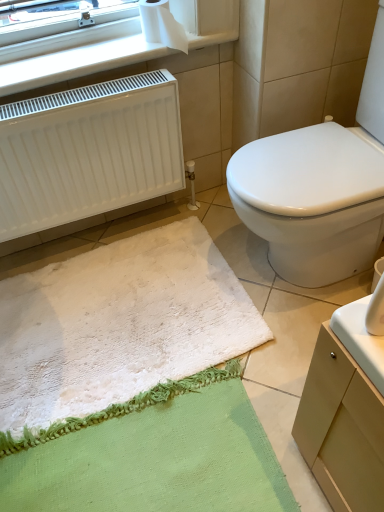
Question: Is white paper at upper left looking in the opposite direction of white glossy toilet at center?

Choices:
 (A) yes
 (B) no

Answer: (B)

Question: Does white paper at upper left have a lesser width compared to white glossy toilet at center?

Choices:
 (A) yes
 (B) no

Answer: (A)

Question: Does white paper at upper left have a lesser height compared to white glossy toilet at center?

Choices:
 (A) no
 (B) yes

Answer: (B)

Question: Can you confirm if white paper at upper left is wider than white glossy toilet at center?

Choices:
 (A) yes
 (B) no

Answer: (B)

Question: From the image's perspective, is white paper at upper left under white glossy toilet at center?

Choices:
 (A) yes
 (B) no

Answer: (B)

Question: From the image's perspective, is white plastic radiator at upper left above or below white paper at upper left?

Choices:
 (A) below
 (B) above

Answer: (A)

Question: Does point (155, 52) appear closer or farther from the camera than point (187, 52)?

Choices:
 (A) farther
 (B) closer

Answer: (B)

Question: Visually, is white plastic radiator at upper left positioned to the left or to the right of white paper at upper left?

Choices:
 (A) left
 (B) right

Answer: (A)

Question: In terms of size, does white plastic radiator at upper left appear bigger or smaller than white paper at upper left?

Choices:
 (A) big
 (B) small

Answer: (A)

Question: From the image's perspective, relative to white plastic radiator at upper left, is white glossy toilet at center above or below?

Choices:
 (A) above
 (B) below

Answer: (B)

Question: Relative to white plastic radiator at upper left, is white glossy toilet at center in front or behind?

Choices:
 (A) front
 (B) behind

Answer: (A)

Question: Is white glossy toilet at center bigger or smaller than white plastic radiator at upper left?

Choices:
 (A) small
 (B) big

Answer: (B)

Question: Is point (271, 143) closer or farther from the camera than point (135, 31)?

Choices:
 (A) farther
 (B) closer

Answer: (B)

Question: Is white fluffy bath mat at lower left bigger or smaller than white matte radiator at left?

Choices:
 (A) big
 (B) small

Answer: (B)

Question: From the image's perspective, is white fluffy bath mat at lower left located above or below white matte radiator at left?

Choices:
 (A) above
 (B) below

Answer: (B)